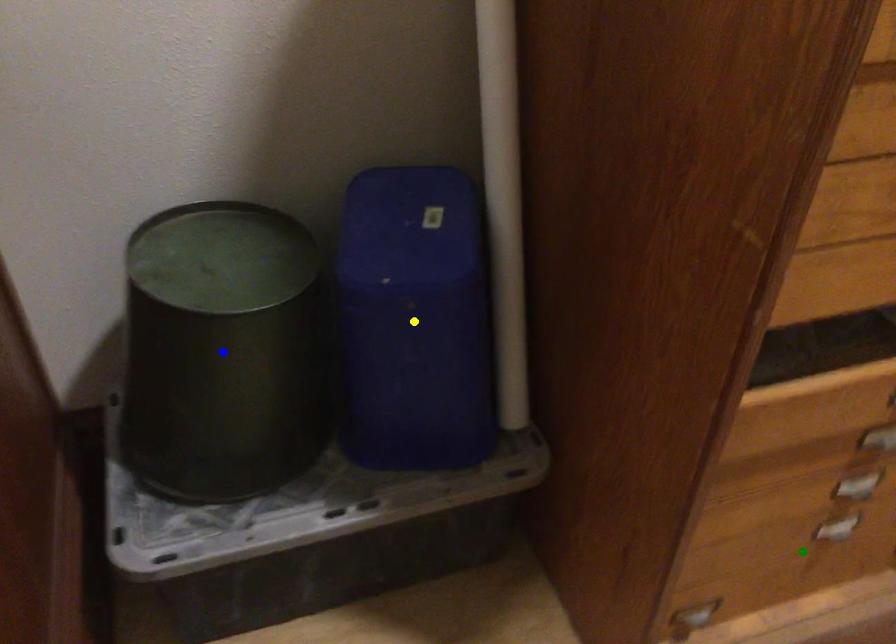
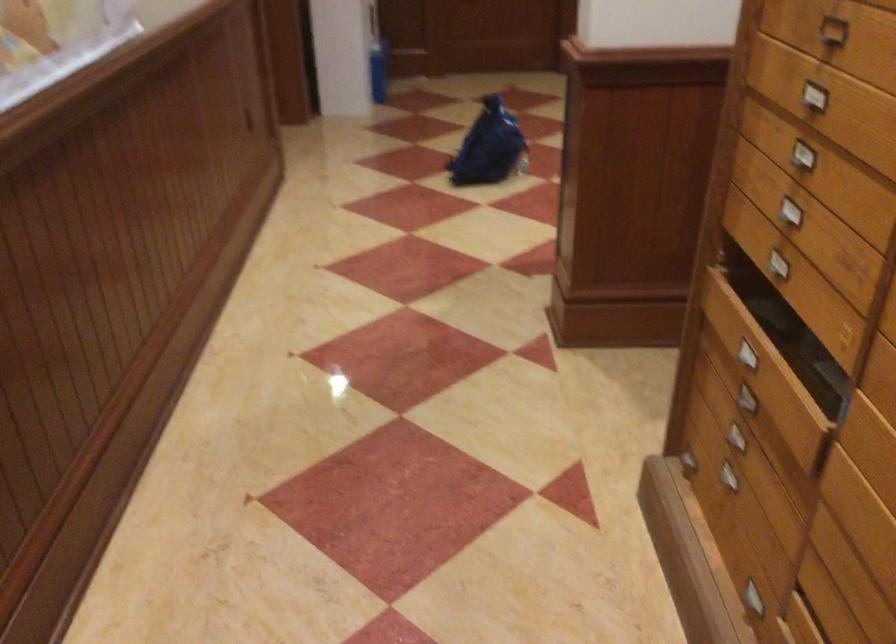
I am providing you with two images of the same scene from different viewpoints. Three points are marked in image1. Which point corresponds to a part or object that is occluded in image2?In image1, three points are marked. Which of them correspond to a part or object that is occluded in image2?Among the three points shown in image1, which one corresponds to a part or object that is no longer visible due to occlusion in image2?

blue point, yellow point cannot be seen in image2.